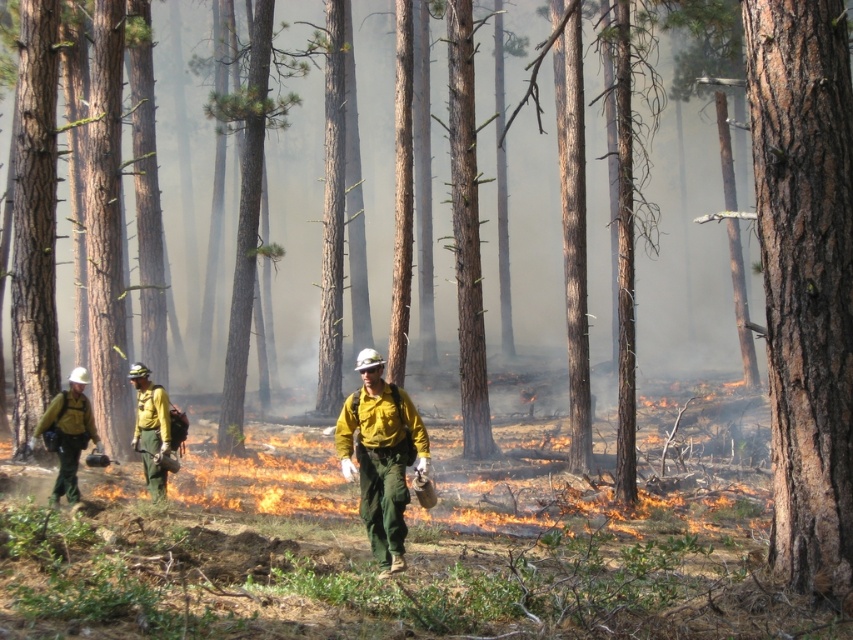
Is yellow-green fabric uniform at center wider than yellow matte uniform at center?

Correct, the width of yellow-green fabric uniform at center exceeds that of yellow matte uniform at center.

Who is lower down, yellow-green fabric uniform at center or yellow matte uniform at center?

Positioned lower is yellow matte uniform at center.

You are a GUI agent. You are given a task and a screenshot of the screen. Output one action in this format:
    pyautogui.click(x=<x>, y=<y>)
    Task: Click on the yellow-green fabric uniform at center
    The width and height of the screenshot is (853, 640).
    Given the screenshot: What is the action you would take?
    pyautogui.click(x=381, y=456)

Is yellow-green fabric uniform at center behind yellow fabric helmet at center?

No, yellow-green fabric uniform at center is closer to the viewer.

Is yellow-green fabric uniform at center wider than yellow fabric helmet at center?

Correct, the width of yellow-green fabric uniform at center exceeds that of yellow fabric helmet at center.

Which is behind, point (343, 410) or point (155, 433)?

Point (155, 433)

Identify the location of yellow-green fabric uniform at center. (381, 456).

In the scene shown: Can you confirm if brown rough bark tree at right is positioned below yellow-green fabric uniform at center?

Actually, brown rough bark tree at right is above yellow-green fabric uniform at center.

Locate an element on the screen. brown rough bark tree at right is located at coordinates (805, 278).

Between point (845, 228) and point (396, 408), which one is positioned behind?

The point (396, 408) is behind.

The image size is (853, 640). I want to click on brown rough bark tree at right, so click(x=805, y=278).